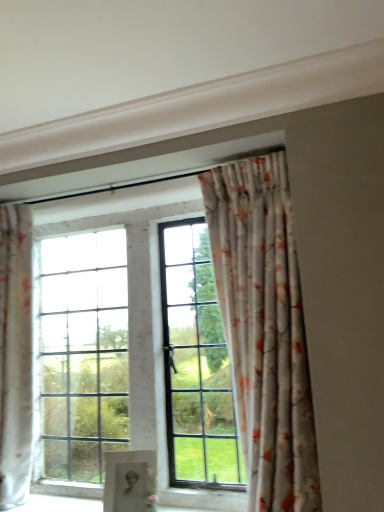
What do you see at coordinates (15, 354) in the screenshot? Image resolution: width=384 pixels, height=512 pixels. I see `floral fabric curtain at left, arranged as the second curtain when viewed from the right` at bounding box center [15, 354].

The image size is (384, 512). What are the coordinates of `white glossy wood at lower center` in the screenshot? It's located at (204, 499).

This screenshot has height=512, width=384. Describe the element at coordinates (204, 499) in the screenshot. I see `white glossy wood at lower center` at that location.

In order to click on matte black portrait at center in this screenshot , I will do `click(129, 480)`.

Where is `floral fabric curtain at left, arranged as the second curtain when viewed from the right`? This screenshot has width=384, height=512. floral fabric curtain at left, arranged as the second curtain when viewed from the right is located at coordinates (15, 354).

In the scene shown: Considering the relative sizes of floral fabric curtain at left, arranged as the second curtain when viewed from the right, and matte black portrait at center in the image provided, is floral fabric curtain at left, arranged as the second curtain when viewed from the right, shorter than matte black portrait at center?

In fact, floral fabric curtain at left, arranged as the second curtain when viewed from the right, may be taller than matte black portrait at center.

Considering the sizes of objects floral fabric curtain at left, arranged as the 1th curtain when viewed from the left, and matte black portrait at center in the image provided, who is wider, floral fabric curtain at left, arranged as the 1th curtain when viewed from the left, or matte black portrait at center?

Wider between the two is floral fabric curtain at left, arranged as the 1th curtain when viewed from the left.

Would you say floral fabric curtain at left, arranged as the second curtain when viewed from the right, is inside or outside matte black portrait at center?

floral fabric curtain at left, arranged as the second curtain when viewed from the right, is not inside matte black portrait at center, it's outside.

Does floral fabric curtain at upper center, the first curtain viewed from the right, have a greater width compared to floral fabric curtain at left, arranged as the second curtain when viewed from the right?

Yes, floral fabric curtain at upper center, the first curtain viewed from the right, is wider than floral fabric curtain at left, arranged as the second curtain when viewed from the right.

Is floral fabric curtain at upper center, arranged as the 2th curtain when viewed from the left, taller or shorter than floral fabric curtain at left, arranged as the 1th curtain when viewed from the left?

Clearly, floral fabric curtain at upper center, arranged as the 2th curtain when viewed from the left, is shorter compared to floral fabric curtain at left, arranged as the 1th curtain when viewed from the left.

From a real-world perspective, between floral fabric curtain at upper center, the first curtain viewed from the right, and floral fabric curtain at left, arranged as the 1th curtain when viewed from the left, who is vertically lower?

In real-world perspective, floral fabric curtain at left, arranged as the 1th curtain when viewed from the left, is lower.

Looking at the image, does floral fabric curtain at upper center, the first curtain viewed from the right, seem bigger or smaller compared to floral fabric curtain at left, arranged as the second curtain when viewed from the right?

Considering their sizes, floral fabric curtain at upper center, the first curtain viewed from the right, takes up more space than floral fabric curtain at left, arranged as the second curtain when viewed from the right.

Is matte black portrait at center further to camera compared to floral fabric curtain at left, arranged as the 1th curtain when viewed from the left?

That is False.

Is point (129, 482) closer to viewer compared to point (11, 243)?

Yes, point (129, 482) is in front of point (11, 243).

Is matte black portrait at center positioned with its back to floral fabric curtain at left, arranged as the 1th curtain when viewed from the left?

That's not correct — matte black portrait at center is not looking away from floral fabric curtain at left, arranged as the 1th curtain when viewed from the left.

Would you say floral fabric curtain at left, arranged as the second curtain when viewed from the right, is part of matte black portrait at center's contents?

No, floral fabric curtain at left, arranged as the second curtain when viewed from the right, is located outside of matte black portrait at center.

Between floral fabric curtain at upper center, arranged as the 2th curtain when viewed from the left, and white glossy wood at lower center, which one has smaller size?

Smaller between the two is white glossy wood at lower center.

From the image's perspective, is floral fabric curtain at upper center, the first curtain viewed from the right, located above white glossy wood at lower center?

Yes, from the image's perspective, floral fabric curtain at upper center, the first curtain viewed from the right, is above white glossy wood at lower center.

In the image, is floral fabric curtain at upper center, the first curtain viewed from the right, on the left side or the right side of white glossy wood at lower center?

floral fabric curtain at upper center, the first curtain viewed from the right, is to the right of white glossy wood at lower center.

Is floral fabric curtain at left, arranged as the second curtain when viewed from the right, positioned in front of white glossy wood at lower center?

No, the depth of floral fabric curtain at left, arranged as the second curtain when viewed from the right, is greater than that of white glossy wood at lower center.

Does floral fabric curtain at left, arranged as the second curtain when viewed from the right, have a lesser height compared to white glossy wood at lower center?

No.

Would you say floral fabric curtain at left, arranged as the 1th curtain when viewed from the left, contains white glossy wood at lower center?

No, white glossy wood at lower center is not a part of floral fabric curtain at left, arranged as the 1th curtain when viewed from the left.

How many degrees apart are the facing directions of white glossy wood at lower center and floral fabric curtain at left, arranged as the second curtain when viewed from the right?

0.00221 degrees separate the facing orientations of white glossy wood at lower center and floral fabric curtain at left, arranged as the second curtain when viewed from the right.

Based on their sizes in the image, would you say white glossy wood at lower center is bigger or smaller than floral fabric curtain at left, arranged as the 1th curtain when viewed from the left?

white glossy wood at lower center is smaller than floral fabric curtain at left, arranged as the 1th curtain when viewed from the left.

Which of these two, white glossy wood at lower center or floral fabric curtain at left, arranged as the 1th curtain when viewed from the left, is wider?

floral fabric curtain at left, arranged as the 1th curtain when viewed from the left, is wider.

Which is correct: white glossy wood at lower center is inside floral fabric curtain at left, arranged as the 1th curtain when viewed from the left, or outside of it?

white glossy wood at lower center lies outside floral fabric curtain at left, arranged as the 1th curtain when viewed from the left.

Who is smaller, matte black portrait at center or white glossy wood at lower center?

matte black portrait at center is smaller.

Consider the image. Is matte black portrait at center in contact with white glossy wood at lower center?

No, matte black portrait at center is not with white glossy wood at lower center.

Is matte black portrait at center surrounding white glossy wood at lower center?

That's incorrect, white glossy wood at lower center is not inside matte black portrait at center.

How different are the orientations of matte black portrait at center and white glossy wood at lower center in degrees?

The angular difference between matte black portrait at center and white glossy wood at lower center is 14.9 degrees.

Find the location of a particular element. curtain that is the 1st object above the matte black portrait at center (from a real-world perspective) is located at coordinates (15, 354).

I want to click on curtain above the floral fabric curtain at left, arranged as the second curtain when viewed from the right (from the image's perspective), so click(264, 329).

Considering their positions, is white glossy wood at lower center positioned further to floral fabric curtain at upper center, arranged as the 2th curtain when viewed from the left, than floral fabric curtain at left, arranged as the 1th curtain when viewed from the left?

Among the two, floral fabric curtain at left, arranged as the 1th curtain when viewed from the left, is located further to floral fabric curtain at upper center, arranged as the 2th curtain when viewed from the left.

Estimate the real-world distances between objects in this image. Which object is further from matte black portrait at center, floral fabric curtain at upper center, arranged as the 2th curtain when viewed from the left, or white glossy wood at lower center?

Based on the image, floral fabric curtain at upper center, arranged as the 2th curtain when viewed from the left, appears to be further to matte black portrait at center.

Considering their positions, is white glossy wood at lower center positioned further to floral fabric curtain at left, arranged as the 1th curtain when viewed from the left, than matte black portrait at center?

white glossy wood at lower center is further to floral fabric curtain at left, arranged as the 1th curtain when viewed from the left.

From the picture: Looking at the image, which one is located closer to white glossy wood at lower center, floral fabric curtain at left, arranged as the second curtain when viewed from the right, or matte black portrait at center?

matte black portrait at center lies closer to white glossy wood at lower center than the other object.

Looking at the image, which one is located closer to floral fabric curtain at left, arranged as the 1th curtain when viewed from the left, white glossy wood at lower center or floral fabric curtain at upper center, arranged as the 2th curtain when viewed from the left?

white glossy wood at lower center.

Considering their positions, is floral fabric curtain at upper center, arranged as the 2th curtain when viewed from the left, positioned closer to matte black portrait at center than floral fabric curtain at left, arranged as the second curtain when viewed from the right?

floral fabric curtain at left, arranged as the second curtain when viewed from the right, is closer to matte black portrait at center.

Based on their spatial positions, is floral fabric curtain at upper center, the first curtain viewed from the right, or floral fabric curtain at left, arranged as the 1th curtain when viewed from the left, further from white glossy wood at lower center?

Among the two, floral fabric curtain at left, arranged as the 1th curtain when viewed from the left, is located further to white glossy wood at lower center.

Based on their spatial positions, is white glossy wood at lower center or matte black portrait at center further from floral fabric curtain at upper center, arranged as the 2th curtain when viewed from the left?

white glossy wood at lower center is positioned further to the anchor floral fabric curtain at upper center, arranged as the 2th curtain when viewed from the left.

Find the location of a particular element. Image resolution: width=384 pixels, height=512 pixels. furniture between floral fabric curtain at left, arranged as the 1th curtain when viewed from the left, and white glossy wood at lower center, in the vertical direction is located at coordinates (129, 480).

In order to click on furniture between floral fabric curtain at upper center, arranged as the 2th curtain when viewed from the left, and white glossy wood at lower center from top to bottom in this screenshot , I will do `click(129, 480)`.

At what (x,y) coordinates should I click in order to perform the action: click on furniture situated between floral fabric curtain at left, arranged as the 1th curtain when viewed from the left, and floral fabric curtain at upper center, the first curtain viewed from the right, from left to right. Please return your answer as a coordinate pair (x, y). The image size is (384, 512). Looking at the image, I should click on (129, 480).

Locate an element on the screen. The width and height of the screenshot is (384, 512). window sill between floral fabric curtain at left, arranged as the second curtain when viewed from the right, and floral fabric curtain at upper center, arranged as the 2th curtain when viewed from the left, in the horizontal direction is located at coordinates (x=204, y=499).